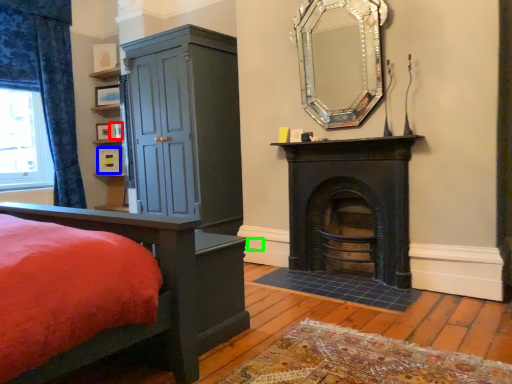
Question: Based on their relative distances, which object is farther from picture frame (highlighted by a red box)? Choose from picture frame (highlighted by a blue box) and power outlet (highlighted by a green box).

Choices:
 (A) picture frame
 (B) power outlet

Answer: (B)